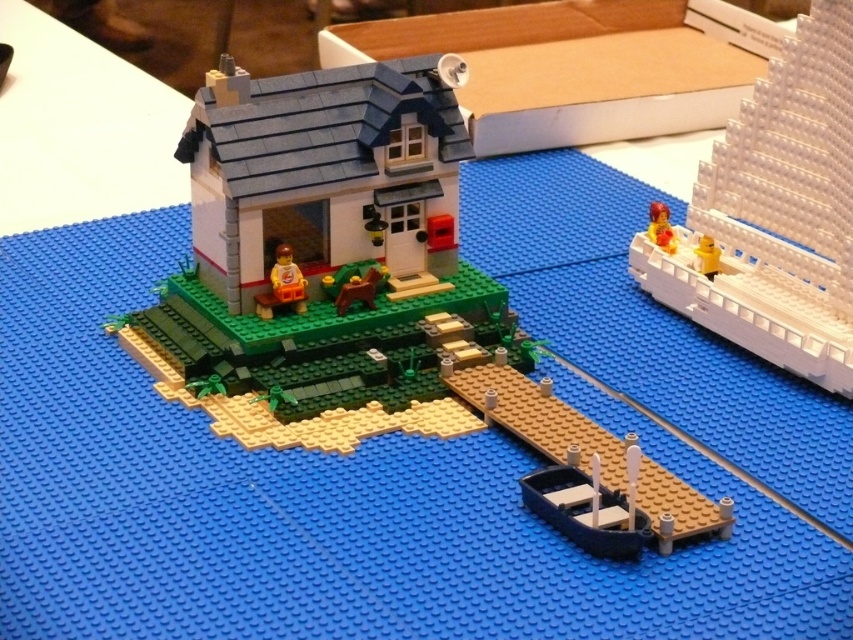
Question: Is translucent orange plastic figure at center to the left of translucent yellow minifigure at upper right from the viewer's perspective?

Choices:
 (A) no
 (B) yes

Answer: (B)

Question: Which of these objects is positioned farthest from the yellow plastic minifigure at right?

Choices:
 (A) smooth white house at center
 (B) translucent yellow minifigure at upper right
 (C) translucent orange plastic figure at center

Answer: (C)

Question: Can you confirm if translucent orange plastic figure at center is positioned to the left of yellow plastic minifigure at right?

Choices:
 (A) yes
 (B) no

Answer: (A)

Question: Is smooth dark blue boat at lower center bigger than translucent yellow minifigure at upper right?

Choices:
 (A) yes
 (B) no

Answer: (A)

Question: Which of the following is the farthest from the observer?

Choices:
 (A) translucent yellow minifigure at upper right
 (B) translucent orange plastic figure at center

Answer: (A)

Question: Among these objects, which one is nearest to the camera?

Choices:
 (A) translucent orange plastic figure at center
 (B) yellow plastic minifigure at right
 (C) white matte sailboat at upper right

Answer: (C)